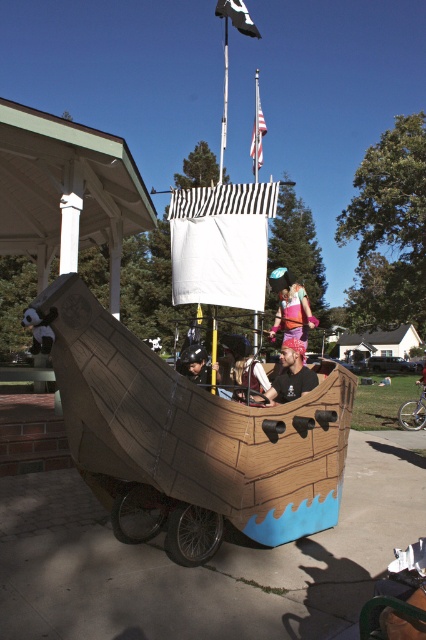
Who is higher up, pink fabric dress at center or matte black helmet at center?

pink fabric dress at center is above.

Can you confirm if pink fabric dress at center is thinner than matte black helmet at center?

No, pink fabric dress at center is not thinner than matte black helmet at center.

Where is `pink fabric dress at center`? This screenshot has height=640, width=426. pink fabric dress at center is located at coordinates (290, 307).

Is pink fabric dress at center to the left of black fabric flag at upper center from the viewer's perspective?

In fact, pink fabric dress at center is to the right of black fabric flag at upper center.

In order to click on pink fabric dress at center in this screenshot , I will do `click(290, 307)`.

At what (x,y) coordinates should I click in order to perform the action: click on pink fabric dress at center. Please return your answer as a coordinate pair (x, y). The image size is (426, 640). Looking at the image, I should click on (290, 307).

Measure the distance from pink fabric dress at center to matte black shirt at center.

pink fabric dress at center is 21.25 inches from matte black shirt at center.

Which is behind, point (293, 289) or point (290, 392)?

Point (293, 289)

Locate an element on the screen. The width and height of the screenshot is (426, 640). pink fabric dress at center is located at coordinates (290, 307).